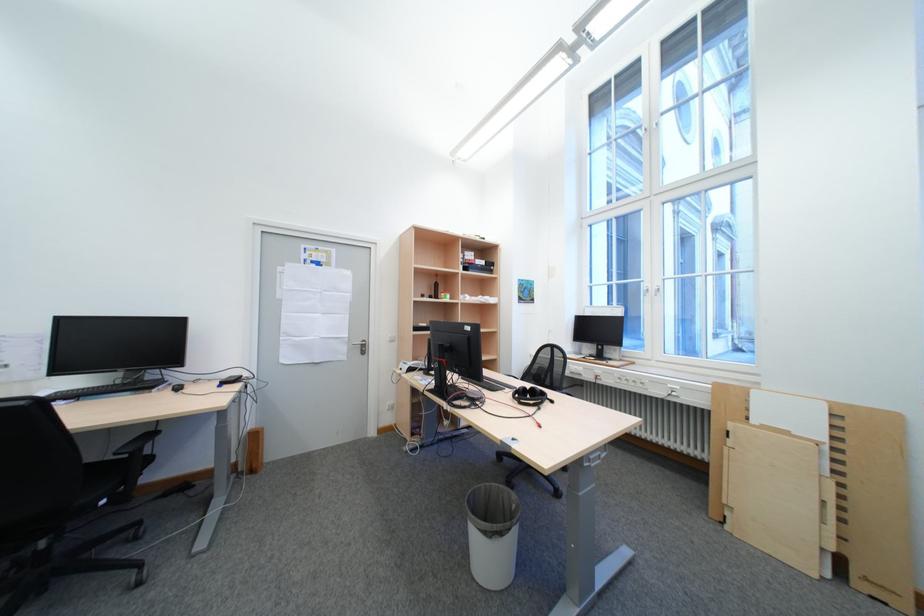
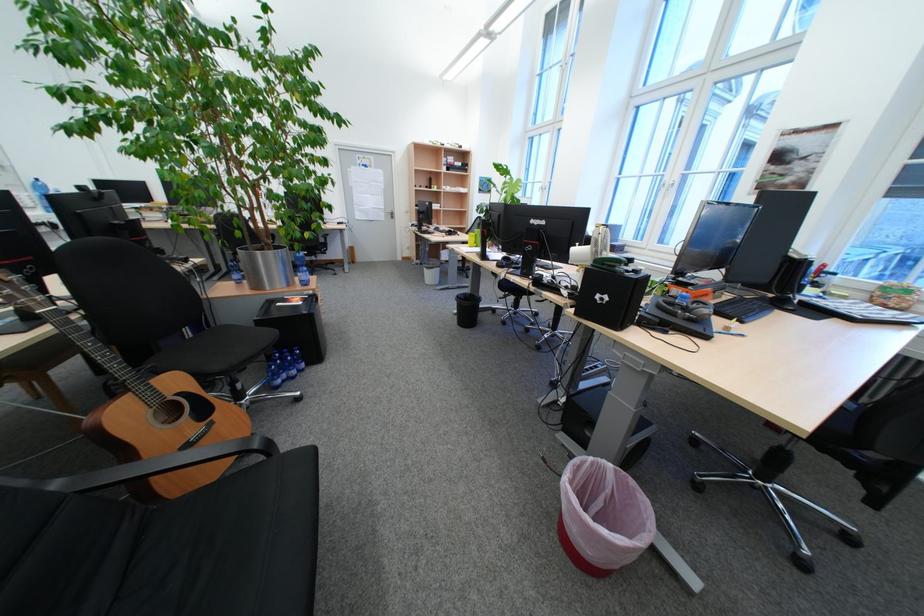
Find the pixel in the second image that matches [353,353] in the first image.

(394, 217)